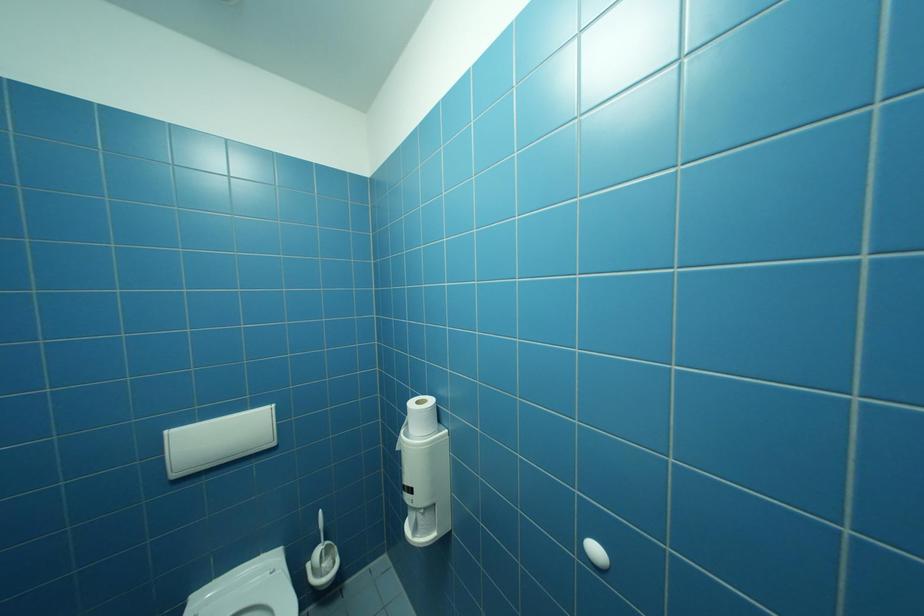
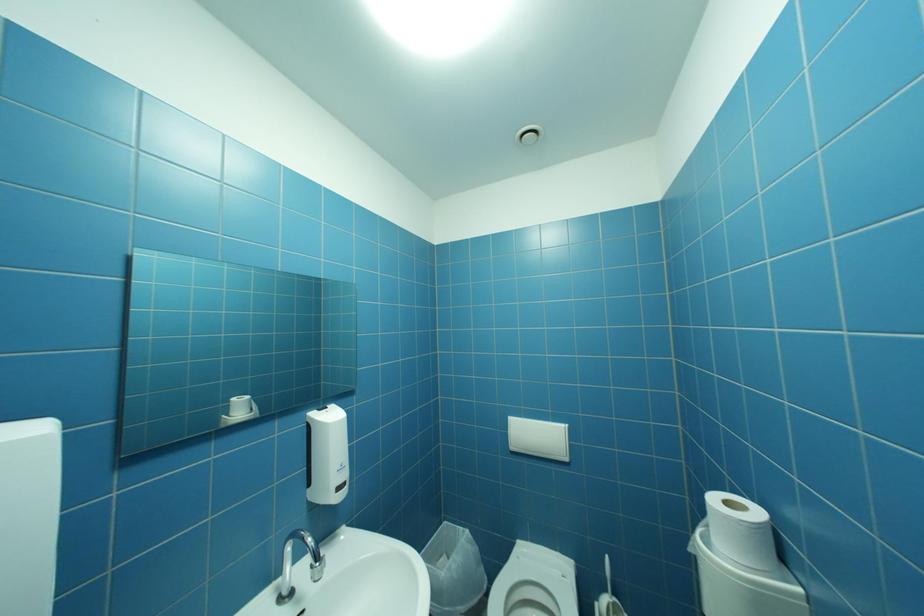
Question: The images are taken continuously from a first-person perspective. In which direction is your viewpoint rotating?

Choices:
 (A) Left
 (B) Right
 (C) Up
 (D) Down

Answer: (A)